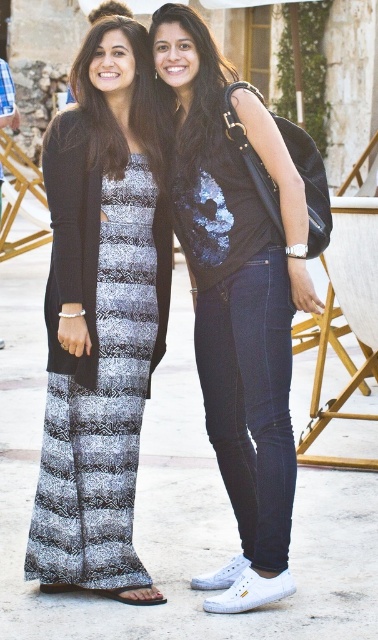
Which of these two, patterned fabric dress at left or matte black vest at center, stands taller?

matte black vest at center is taller.

Does point (48, 384) come behind point (190, 193)?

No, (48, 384) is closer to viewer.

I want to click on patterned fabric dress at left, so click(x=100, y=316).